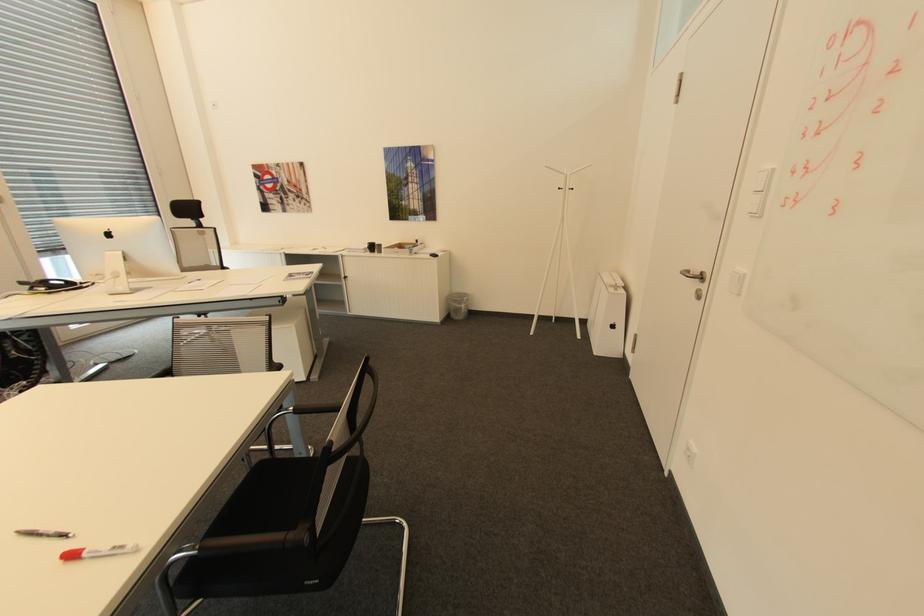
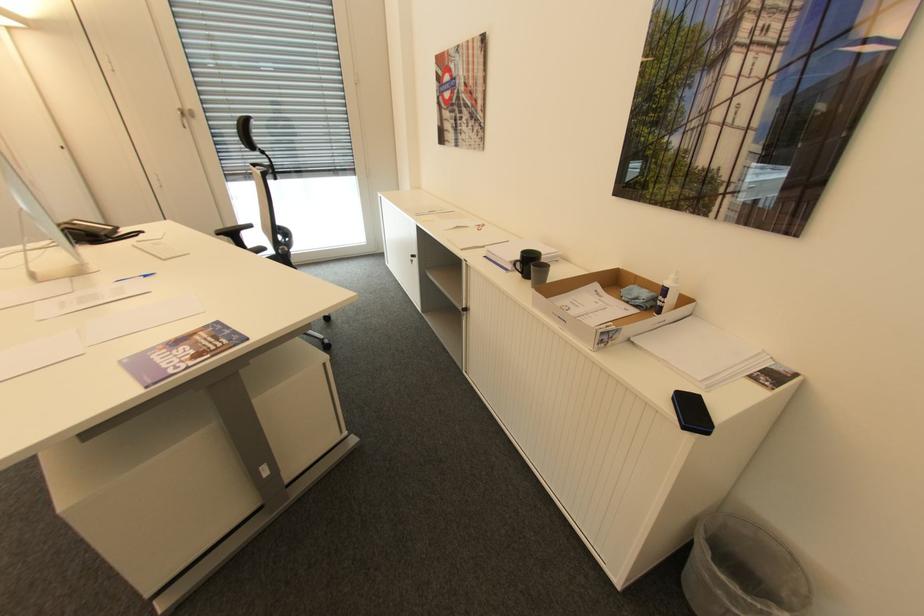
In the second image, find the point that corresponds to [383,245] in the first image.

(550, 268)